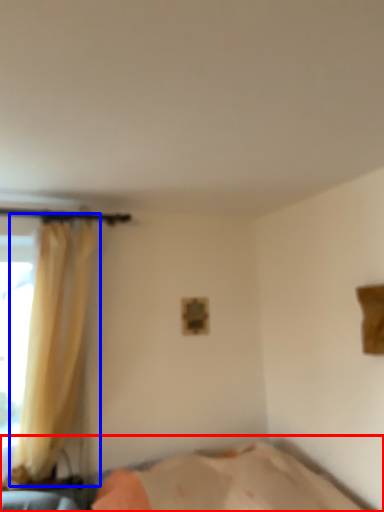
Question: Which point is closer to the camera, bed (highlighted by a red box) or curtain (highlighted by a blue box)?

Choices:
 (A) bed
 (B) curtain

Answer: (A)